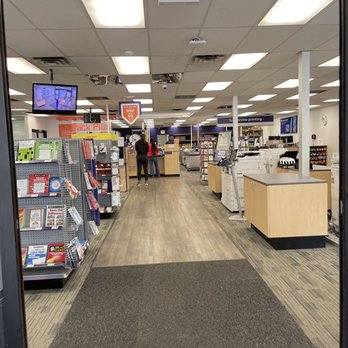
Where is `hardwood flooring`? hardwood flooring is located at coordinates (164, 212).